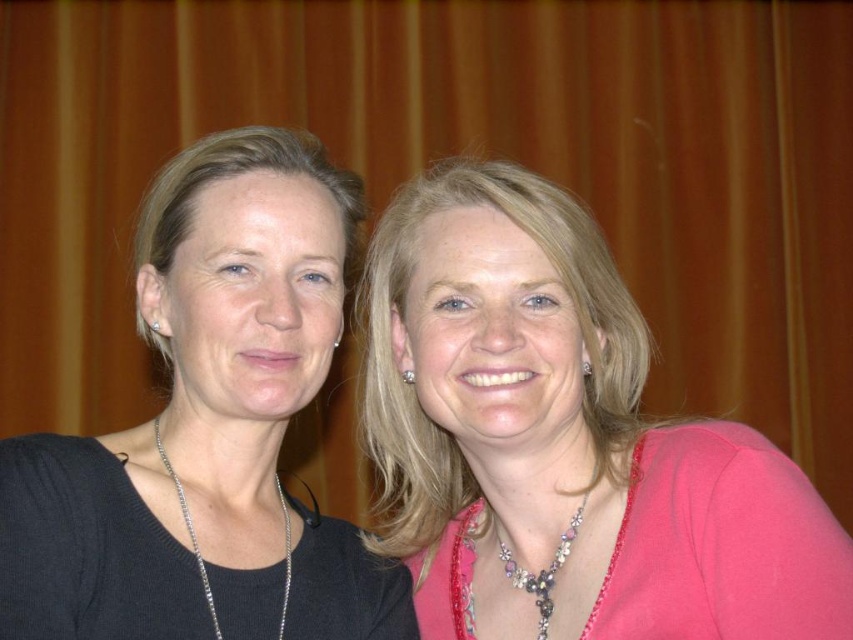
Question: Is pearl and crystal necklace at center to the left of silver metallic necklace at center from the viewer's perspective?

Choices:
 (A) no
 (B) yes

Answer: (A)

Question: Which point is closer to the camera?

Choices:
 (A) silver metallic necklace at center
 (B) pink satin blouse at center

Answer: (B)

Question: Observing the image, what is the correct spatial positioning of black matte sweater at left in reference to silver metallic necklace at center?

Choices:
 (A) left
 (B) right

Answer: (A)

Question: Which object is the farthest from the silver metallic necklace at center?

Choices:
 (A) pink satin blouse at center
 (B) black matte sweater at left
 (C) pearl and crystal necklace at center

Answer: (C)

Question: Does black matte sweater at left lie behind pearl and crystal necklace at center?

Choices:
 (A) yes
 (B) no

Answer: (B)

Question: Which of the following is the farthest from the observer?

Choices:
 (A) black matte sweater at left
 (B) pink satin blouse at center

Answer: (A)